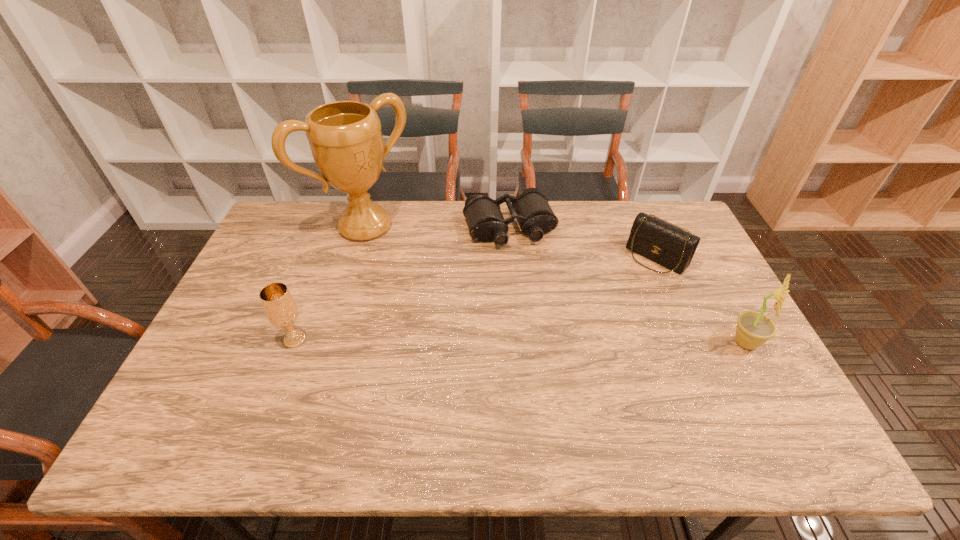
I want to click on free spot between the second shortest object and the tallest object, so click(x=511, y=242).

I want to click on free space that is in between the award and the second object from right to left, so click(x=511, y=242).

Locate which object is the closest to the clutch bag. Please provide its 2D coordinates. Your answer should be formatted as a tuple, i.e. [(x, y)], where the tuple contains the x and y coordinates of a point satisfying the conditions above.

[(753, 329)]

Locate which object ranks second in proximity to the fourth object from left to right. Please provide its 2D coordinates. Your answer should be formatted as a tuple, i.e. [(x, y)], where the tuple contains the x and y coordinates of a point satisfying the conditions above.

[(531, 209)]

Identify the location of free space that satisfies the following two spatial constraints: 1. on the front side of the shortest object; 2. on the left side of the tallest object. Image resolution: width=960 pixels, height=540 pixels. (365, 228).

What are the coordinates of `free space that satisfies the following two spatial constraints: 1. on the front side of the shortest object; 2. on the right side of the tallest object` in the screenshot? It's located at (365, 228).

Find the location of `free region that satisfies the following two spatial constraints: 1. on the front side of the tallest object; 2. on the left side of the shortest object`. free region that satisfies the following two spatial constraints: 1. on the front side of the tallest object; 2. on the left side of the shortest object is located at coordinates (365, 228).

Find the location of a particular element. Image resolution: width=960 pixels, height=540 pixels. vacant space that satisfies the following two spatial constraints: 1. on the front side of the sunflower; 2. on the face of the shortest object is located at coordinates (518, 343).